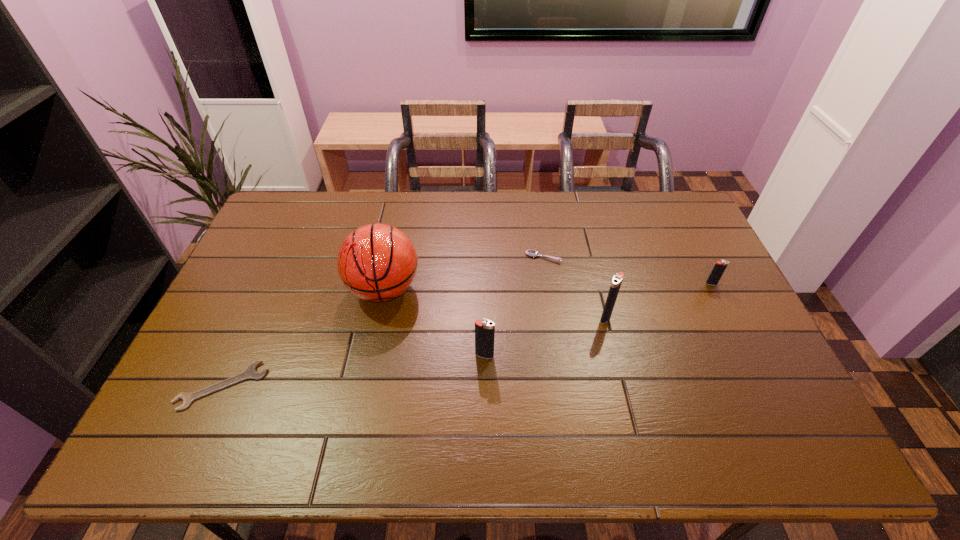
Image resolution: width=960 pixels, height=540 pixels. I want to click on the leftmost object, so click(250, 373).

This screenshot has height=540, width=960. Identify the location of the shortest object. click(x=250, y=373).

You are a GUI agent. You are given a task and a screenshot of the screen. Output one action in this format:
    pyautogui.click(x=<x>, y=<y>)
    Task: Click on the vacant point located 0.280m on the back of the leftmost igniter
    This screenshot has height=540, width=960.
    Given the screenshot: What is the action you would take?
    pyautogui.click(x=484, y=278)

Locate an element on the screen. The width and height of the screenshot is (960, 540). free space located 0.100m on the front of the second igniter from right to left is located at coordinates (615, 353).

Identify the location of vacant space located on the left of the third shortest object. (604, 284).

Image resolution: width=960 pixels, height=540 pixels. I want to click on free region located 0.060m on the right of the third object from right to left, so click(579, 257).

This screenshot has height=540, width=960. In order to click on vacant point located 0.100m on the side with spill of the second object from left to right in this screenshot , I will do `click(372, 347)`.

At what (x,y) coordinates should I click in order to perform the action: click on vacant region located 0.360m on the right of the wrench. Please return your answer as a coordinate pair (x, y). The height and width of the screenshot is (540, 960). Looking at the image, I should click on (404, 386).

Where is `object that is at the near edge`? The height and width of the screenshot is (540, 960). object that is at the near edge is located at coordinates (250, 373).

This screenshot has height=540, width=960. What are the coordinates of `object that is at the left edge` in the screenshot? It's located at (250, 373).